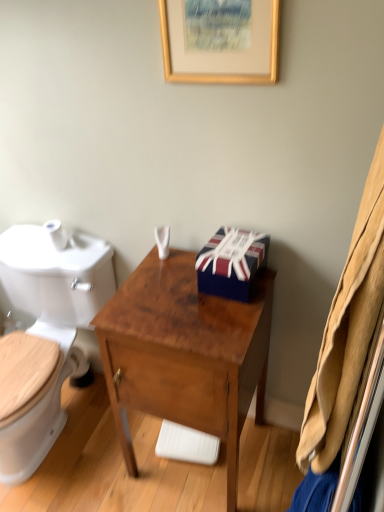
This screenshot has height=512, width=384. Identify the location of free point in front of union jack-patterned gift box at center. (223, 315).